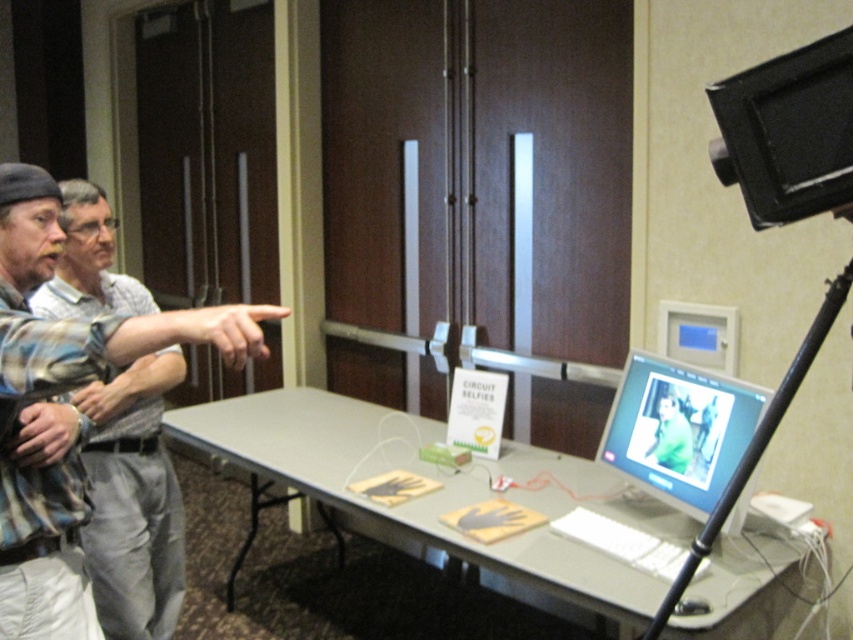
You are a photographer at the event and need to position your camera so that both the plaid shirt at left and the black metal tripod at right are in frame. Which object should you focus on first to ensure both are visible?

The plaid shirt at left is much taller than the black metal tripod at right, so you should focus on the plaid shirt at left first to ensure both are visible in the frame.

You are setting up a presentation and need to adjust the camera angle. Since the black plastic video camera at upper right and the black metal tripod at right are part of the setup, which one is closer to the front of the room?

The black plastic video camera at upper right is in front of the black metal tripod at right, so the camera is closer to the front of the room.

You are setting up for an event and need to place a large banner between the gray plastic table at center and the black metal tripod at right. According to the scene description, where should the banner be placed relative to these two objects?

The gray plastic table at center is located below the black metal tripod at right, so the banner should be placed above the gray plastic table at center and below the black metal tripod at right to position it between them.